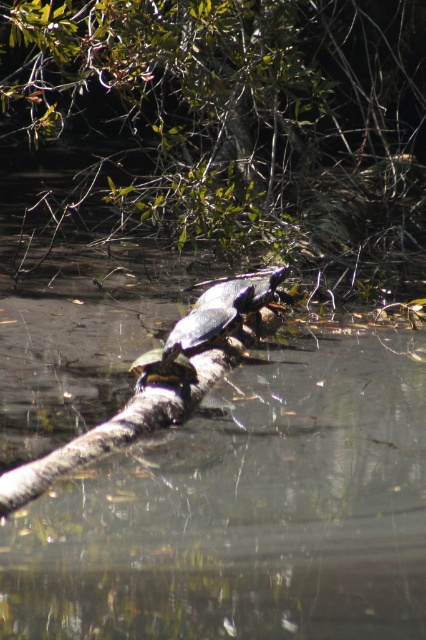
From the picture: You are a photographer trying to capture the turtles on the log. You notice the clear water at branch center and the green leafy tree at upper center in your viewfinder. Which object is closer to your camera lens?

The clear water at branch center is closer to the camera lens because it is in front of the green leafy tree at upper center.

From the picture: You are a wildlife photographer aiming to capture a closeup shot of the shiny dark green tortoise at center and the shiny brown tortoise at center. Since you want to focus on the tortoises, which one should you adjust your camera focus on first to ensure it appears larger in the photo?

The shiny dark green tortoise at center has a greater height compared to the shiny brown tortoise at center, so you should focus on the shiny dark green tortoise at center first to ensure it appears larger in the photo.

You are a wildlife photographer aiming to capture both the shiny dark green tortoise at center and the shiny brown tortoise at center in a single frame. Given their sizes, which tortoise should you focus on to ensure both fit in the photo without zooming in or out?

Since the shiny dark green tortoise at center is larger, you should focus on it first to ensure both fit in the frame without zooming. Adjust your position so both are visible while prioritizing the larger tortoise.